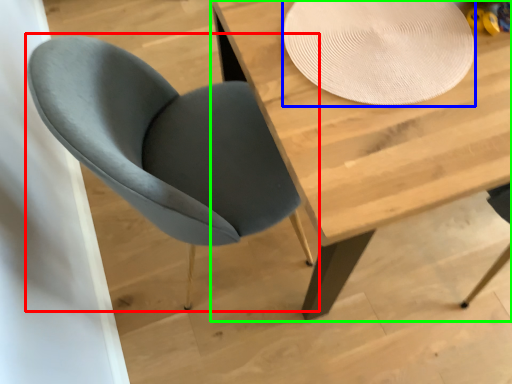
Question: Which object is the farthest from chair (highlighted by a red box)? Choose among these: paper plate (highlighted by a blue box) or table (highlighted by a green box).

Choices:
 (A) paper plate
 (B) table

Answer: (A)